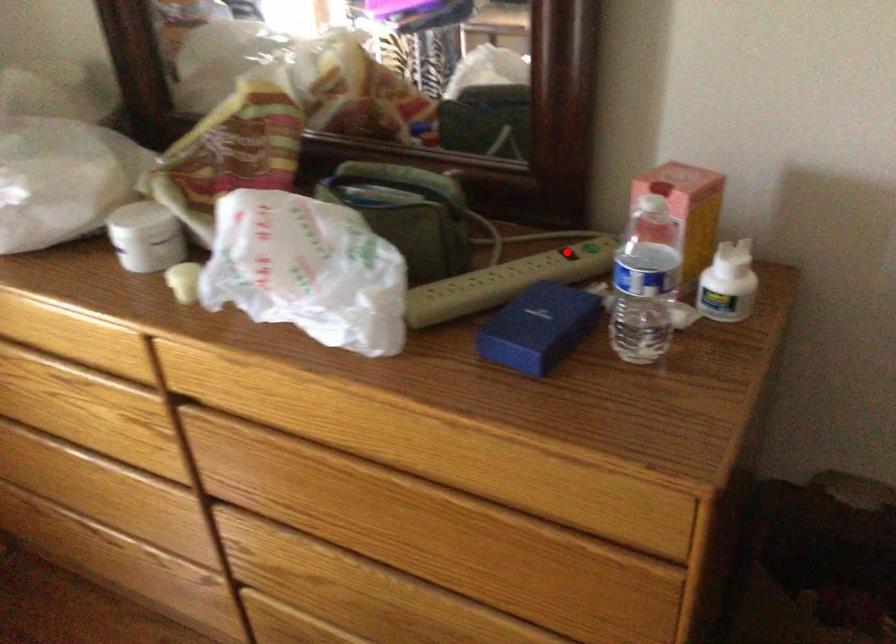
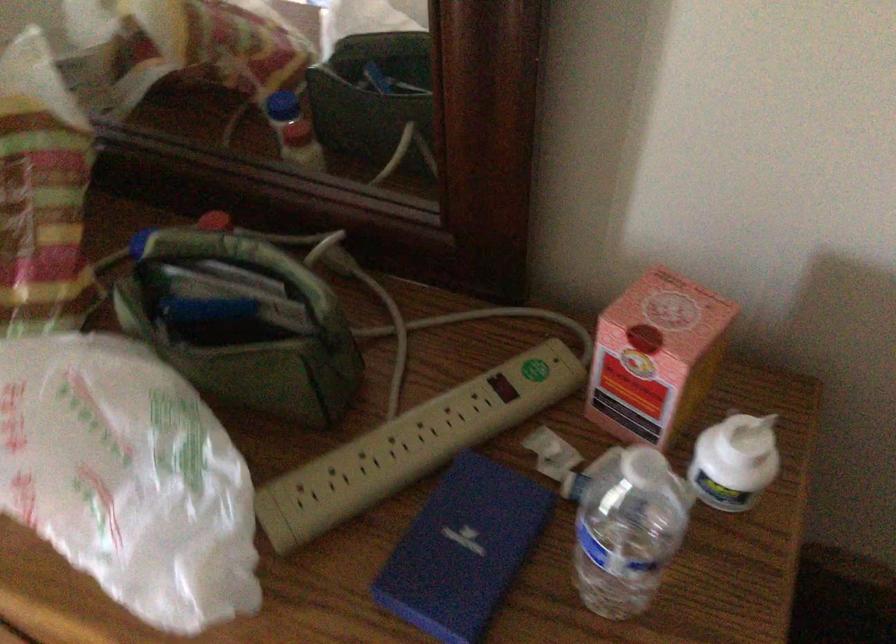
Question: I am providing you with two images of the same scene from different viewpoints. Image1 has a red point marked. In image2, the corresponding 3D location appears at what relative position? Reply with the corresponding letter.

Choices:
 (A) Closer
 (B) Farther

Answer: (A)